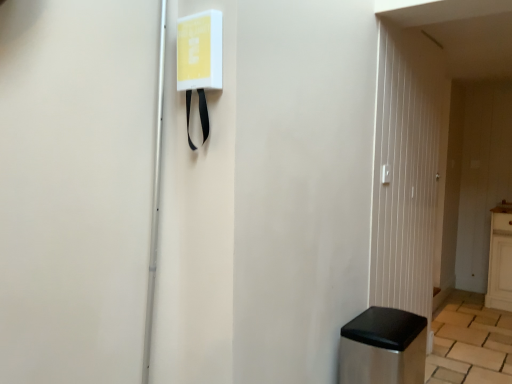
Question: From the image's perspective, is white plastic light switch at upper right over stainless steel trash can at lower right?

Choices:
 (A) yes
 (B) no

Answer: (A)

Question: Is white plastic light switch at upper right with stainless steel trash can at lower right?

Choices:
 (A) no
 (B) yes

Answer: (A)

Question: Can you confirm if white plastic light switch at upper right is shorter than stainless steel trash can at lower right?

Choices:
 (A) yes
 (B) no

Answer: (A)

Question: Is white plastic light switch at upper right behind stainless steel trash can at lower right?

Choices:
 (A) yes
 (B) no

Answer: (A)

Question: Does white plastic light switch at upper right contain stainless steel trash can at lower right?

Choices:
 (A) yes
 (B) no

Answer: (B)

Question: Does white plastic light switch at upper right have a greater width compared to stainless steel trash can at lower right?

Choices:
 (A) no
 (B) yes

Answer: (A)

Question: Are white plastic light switch at upper right and transparent glass door at right making contact?

Choices:
 (A) yes
 (B) no

Answer: (B)

Question: Is white plastic light switch at upper right not near transparent glass door at right?

Choices:
 (A) yes
 (B) no

Answer: (B)

Question: Can you confirm if white plastic light switch at upper right is smaller than transparent glass door at right?

Choices:
 (A) yes
 (B) no

Answer: (A)

Question: Is white plastic light switch at upper right taller than transparent glass door at right?

Choices:
 (A) no
 (B) yes

Answer: (A)

Question: Is white plastic light switch at upper right looking in the opposite direction of transparent glass door at right?

Choices:
 (A) no
 (B) yes

Answer: (B)

Question: Does white plastic light switch at upper right have a lesser height compared to transparent glass door at right?

Choices:
 (A) no
 (B) yes

Answer: (B)

Question: From a real-world perspective, is transparent glass door at right on top of stainless steel trash can at lower right?

Choices:
 (A) yes
 (B) no

Answer: (A)